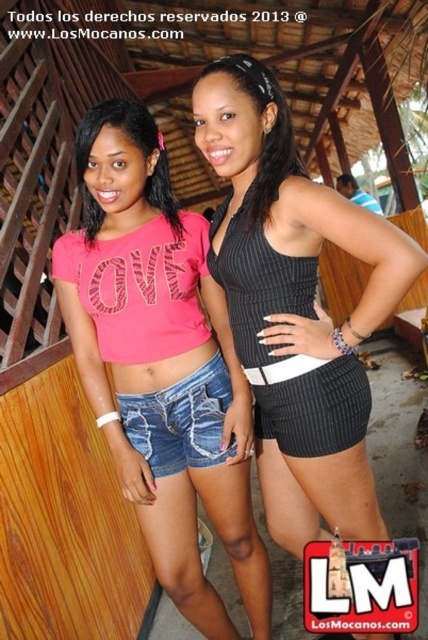
Question: Can you confirm if denim shorts at center is wider than black ribbed shorts at center?

Choices:
 (A) no
 (B) yes

Answer: (B)

Question: Which point appears closest to the camera in this image?

Choices:
 (A) (341, 440)
 (B) (91, 115)
 (C) (335, 429)

Answer: (C)

Question: Which of the following is the closest to the observer?

Choices:
 (A) (89, 112)
 (B) (305, 314)
 (C) (291, 401)

Answer: (B)

Question: Which of the following is the closest to the observer?

Choices:
 (A) (104, 115)
 (B) (237, 132)

Answer: (B)

Question: Is the position of pink denim shorts at center less distant than that of black ribbed tank top at center?

Choices:
 (A) yes
 (B) no

Answer: (B)

Question: Is black ribbed tank top at center closer to the viewer compared to black ribbed shorts at center?

Choices:
 (A) no
 (B) yes

Answer: (B)